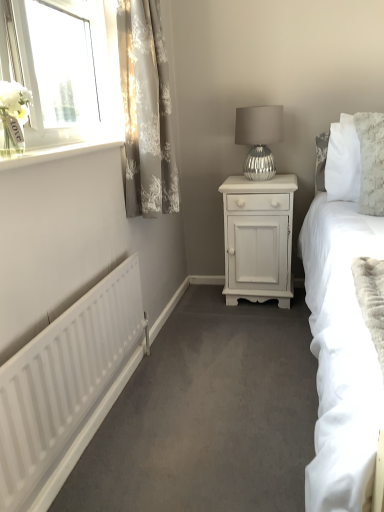
Where is `vacant point to the left of white painted wood nightstand at center`? vacant point to the left of white painted wood nightstand at center is located at coordinates (199, 304).